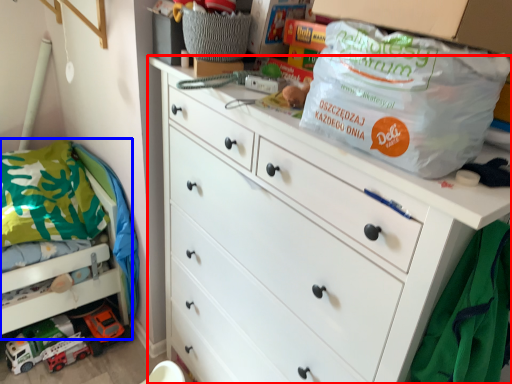
Question: Among these objects, which one is farthest to the camera, chest of drawers (highlighted by a red box) or bunk bed (highlighted by a blue box)?

Choices:
 (A) chest of drawers
 (B) bunk bed

Answer: (B)